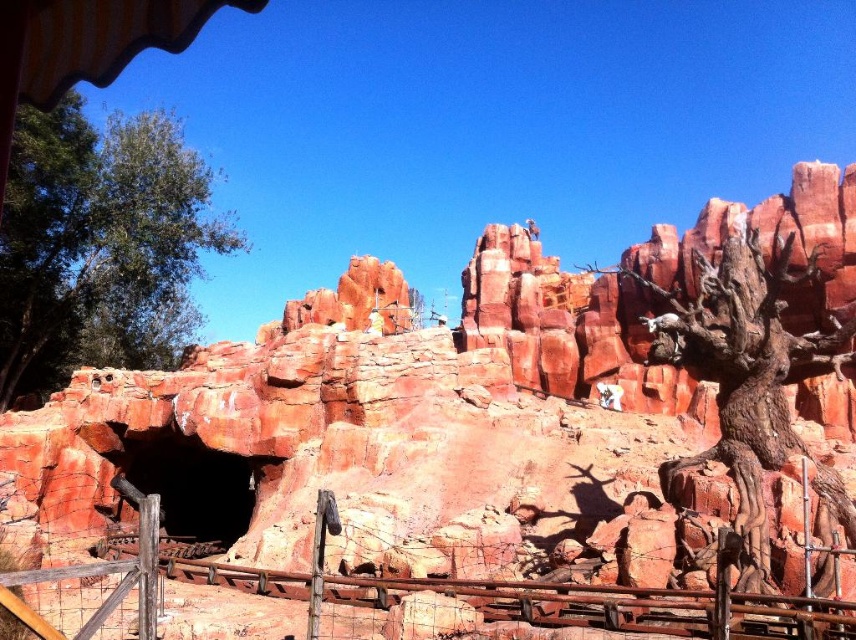
Question: Is the position of green leafy tree at left less distant than that of rusty metal fence at lower center?

Choices:
 (A) no
 (B) yes

Answer: (A)

Question: Among these points, which one is farthest from the camera?

Choices:
 (A) (489, 244)
 (B) (548, 632)
 (C) (817, 349)

Answer: (A)

Question: Is green leafy tree at left positioned in front of rusty metal fence at lower center?

Choices:
 (A) no
 (B) yes

Answer: (A)

Question: Observing the image, what is the correct spatial positioning of green leafy tree at left in reference to rusty metal fence at lower center?

Choices:
 (A) right
 (B) left

Answer: (B)

Question: Based on their relative distances, which object is nearer to the green leafy tree at left?

Choices:
 (A) rustic stone rock formation at center
 (B) rustic bark tree at right
 (C) rusty metal fence at lower center

Answer: (A)

Question: Which point is closer to the camera?

Choices:
 (A) rustic bark tree at right
 (B) rusty metal fence at lower center

Answer: (B)